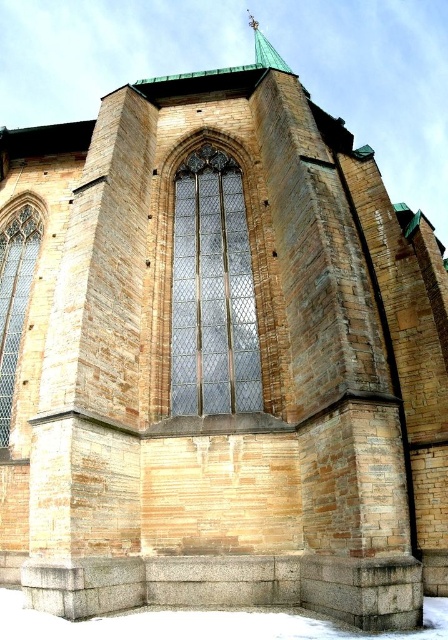
Based on the photo, can you confirm if clear glass window at center is thinner than clear glass window at left?

Incorrect, clear glass window at center's width is not less than clear glass window at left's.

Measure the distance between point (190,330) and camera.

Point (190,330) is 59.31 meters away from camera.

The image size is (448, 640). Identify the location of clear glass window at center. (212, 291).

Is white powdery snow at lower center above clear glass window at left?

Incorrect, white powdery snow at lower center is not positioned above clear glass window at left.

This screenshot has height=640, width=448. What do you see at coordinates (202, 624) in the screenshot? I see `white powdery snow at lower center` at bounding box center [202, 624].

Which is in front, point (172, 611) or point (8, 323)?

Point (172, 611) is more forward.

Find the location of a particular element. This screenshot has height=640, width=448. white powdery snow at lower center is located at coordinates (202, 624).

Is clear glass window at left to the left of green copper spire at upper center from the viewer's perspective?

Yes, clear glass window at left is to the left of green copper spire at upper center.

The height and width of the screenshot is (640, 448). Find the location of `clear glass window at left`. clear glass window at left is located at coordinates (14, 298).